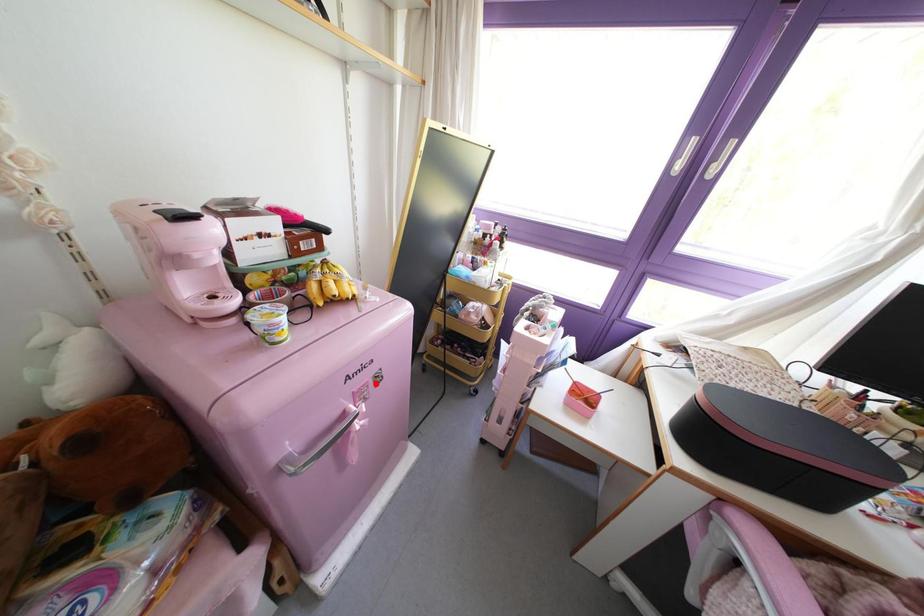
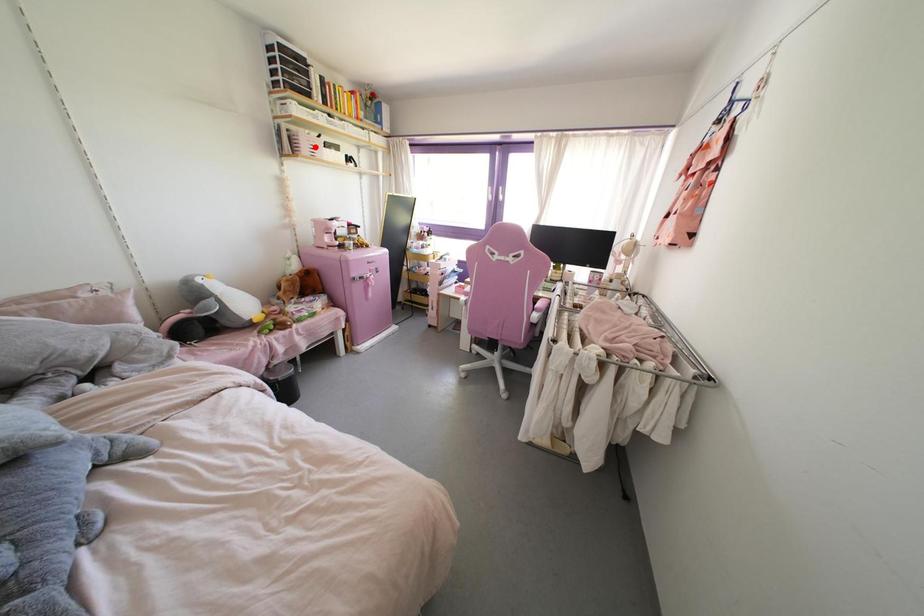
I am providing you with two images of the same scene from different viewpoints. A red point is marked on the first image and another point is marked on the second image. Are the points marked in image1 and image2 representing the same 3D position?

No